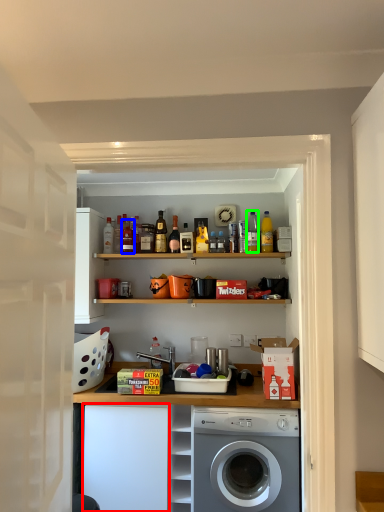
Question: Estimate the real-world distances between objects in this image. Which object is farther from cabinetry (highlighted by a red box), bottle (highlighted by a blue box) or bottle (highlighted by a green box)?

Choices:
 (A) bottle
 (B) bottle

Answer: (B)